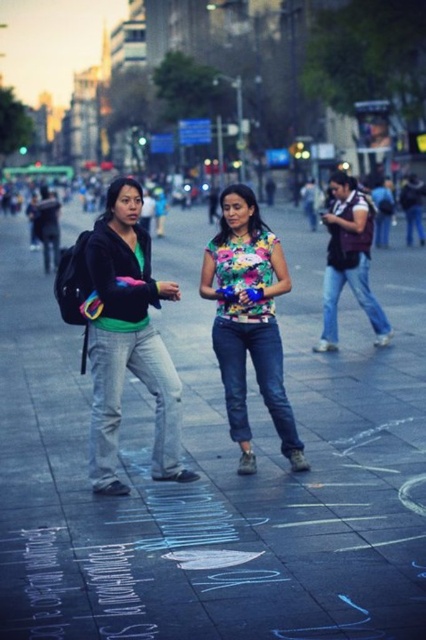
Question: Which object appears closest to the camera in this image?

Choices:
 (A) floral fabric shirt at center
 (B) matte black jacket at left

Answer: (B)

Question: Which object is closer to the camera taking this photo?

Choices:
 (A) matte black jacket at left
 (B) smooth concrete sidewalk at center

Answer: (B)

Question: Is matte black jacket at left positioned before floral fabric shirt at center?

Choices:
 (A) no
 (B) yes

Answer: (B)

Question: Does matte black jacket at left have a larger size compared to floral fabric shirt at center?

Choices:
 (A) yes
 (B) no

Answer: (B)

Question: Which of these objects is positioned farthest from the matte black jacket at left?

Choices:
 (A) smooth concrete sidewalk at center
 (B) floral fabric shirt at center

Answer: (A)

Question: Can you confirm if smooth concrete sidewalk at center is bigger than matte black jacket at left?

Choices:
 (A) no
 (B) yes

Answer: (B)